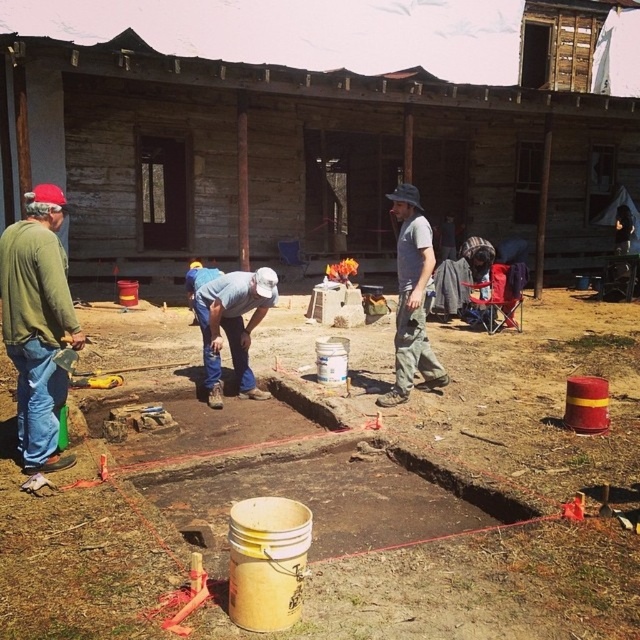
Can you confirm if yellow plastic bucket at center is positioned to the left of gray cotton shirt at center?

Yes, yellow plastic bucket at center is to the left of gray cotton shirt at center.

Can you confirm if yellow plastic bucket at center is bigger than gray cotton shirt at center?

No.

Does point (1, 374) come in front of point (406, 381)?

No, (1, 374) is further to viewer.

The width and height of the screenshot is (640, 640). I want to click on yellow plastic bucket at center, so click(348, 484).

Is yellow plastic bucket at center smaller than green matte shirt at left?

Yes.

Can you confirm if yellow plastic bucket at center is positioned above green matte shirt at left?

Incorrect, yellow plastic bucket at center is not positioned above green matte shirt at left.

Does point (252, 412) come behind point (35, 436)?

Yes, it is.

The width and height of the screenshot is (640, 640). Find the location of `yellow plastic bucket at center`. yellow plastic bucket at center is located at coordinates (348, 484).

Does wooden hut at center have a greater width compared to gray cotton shirt at center?

Yes.

Can you confirm if wooden hut at center is bigger than gray cotton shirt at center?

Correct, wooden hut at center is larger in size than gray cotton shirt at center.

Does point (563, 216) come farther from viewer compared to point (401, 236)?

Yes, it is behind point (401, 236).

I want to click on wooden hut at center, so (296, 157).